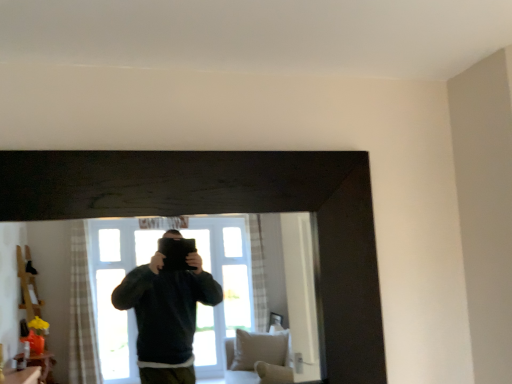
What do you see at coordinates (38, 283) in the screenshot? The width and height of the screenshot is (512, 384). I see `black wood mirror at center` at bounding box center [38, 283].

What is the approximate height of black wood mirror at center?

black wood mirror at center is 80.44 centimeters in height.

In order to click on black wood mirror at center in this screenshot , I will do `click(38, 283)`.

This screenshot has width=512, height=384. Find the location of `black wood mirror at center`. black wood mirror at center is located at coordinates (38, 283).